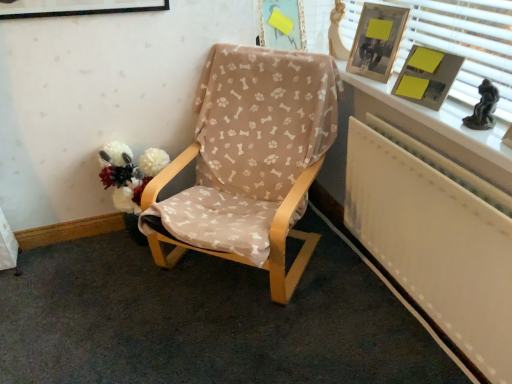
Question: Is matte plastic picture frame at upper center, the 2th picture frame viewed from the front, wider or thinner than white painted wood at upper right?

Choices:
 (A) wide
 (B) thin

Answer: (A)

Question: Considering their positions, is matte plastic picture frame at upper center, the 2th picture frame viewed from the front, located in front of or behind white painted wood at upper right?

Choices:
 (A) front
 (B) behind

Answer: (B)

Question: Which of these objects is positioned farthest from the matte plastic picture frame at upper center, acting as the 2th picture frame starting from the right?

Choices:
 (A) wooden picture frame at upper right, the second picture frame in the back-to-front sequence
 (B) beige fabric-covered chair at center
 (C) white painted wood at upper right
 (D) white painted wood at upper right
 (E) yellow paper at upper right

Answer: (E)

Question: Which is nearer to the matte plastic picture frame at upper center, acting as the 2th picture frame starting from the right?

Choices:
 (A) wooden picture frame at upper right, which ranks as the 1th picture frame in right-to-left order
 (B) yellow paper at upper right
 (C) white painted wood at upper right
 (D) beige fabric-covered chair at center
 (E) white painted wood at upper right

Answer: (A)